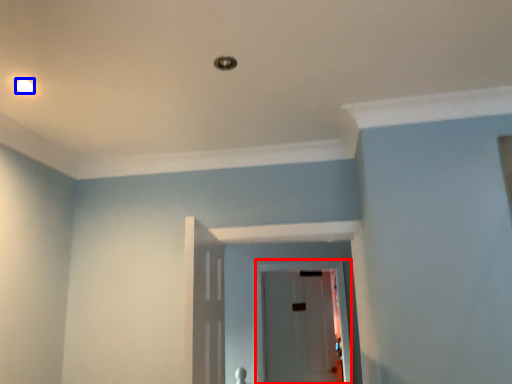
Question: Which point is closer to the camera, glass door (highlighted by a red box) or lighting (highlighted by a blue box)?

Choices:
 (A) glass door
 (B) lighting

Answer: (B)